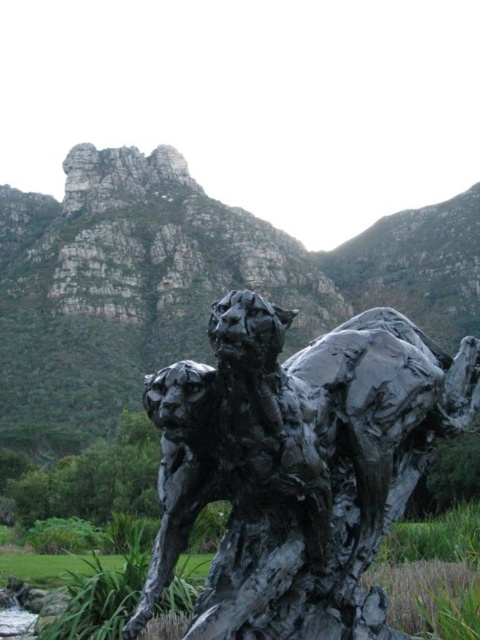
Is black textured sculpture at center to the left of rugged stone mountain at upper center from the viewer's perspective?

In fact, black textured sculpture at center is to the right of rugged stone mountain at upper center.

Can you confirm if black textured sculpture at center is taller than rugged stone mountain at upper center?

In fact, black textured sculpture at center may be shorter than rugged stone mountain at upper center.

Is point (309, 529) more distant than point (100, 278)?

No, it is in front of (100, 278).

Where is `black textured sculpture at center`? The image size is (480, 640). black textured sculpture at center is located at coordinates (298, 465).